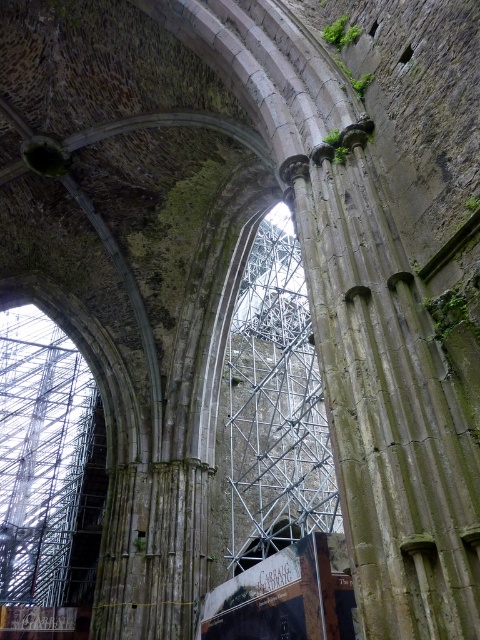
Question: Which point is closer to the camera?

Choices:
 (A) green mossy stone pillar at center
 (B) metallic scaffolding at center

Answer: (A)

Question: Does green mossy stone pillar at center have a larger size compared to metallic scaffolding at center?

Choices:
 (A) no
 (B) yes

Answer: (A)

Question: Is green mossy stone pillar at center in front of metallic scaffolding at center?

Choices:
 (A) yes
 (B) no

Answer: (A)

Question: Which object appears closest to the camera in this image?

Choices:
 (A) metallic scaffolding at center
 (B) green mossy stone pillar at center

Answer: (B)

Question: Can you confirm if green mossy stone pillar at center is wider than metallic scaffolding at center?

Choices:
 (A) yes
 (B) no

Answer: (B)

Question: Which of the following is the closest to the observer?

Choices:
 (A) (262, 340)
 (B) (397, 596)

Answer: (B)